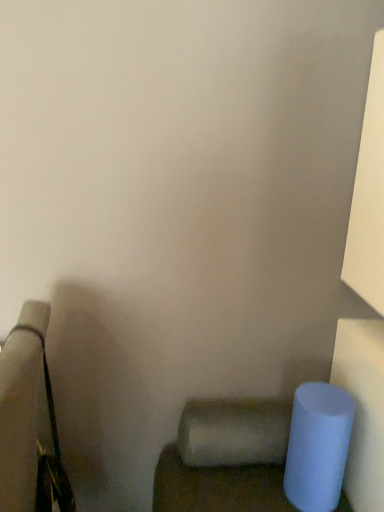
Question: Is satin white toilet paper at lower center taller or shorter than matte blue cylinder at lower right?

Choices:
 (A) tall
 (B) short

Answer: (B)

Question: Is satin white toilet paper at lower center to the left or to the right of matte blue cylinder at lower right in the image?

Choices:
 (A) right
 (B) left

Answer: (B)

Question: Considering the positions of satin white toilet paper at lower center and matte blue cylinder at lower right in the image, is satin white toilet paper at lower center bigger or smaller than matte blue cylinder at lower right?

Choices:
 (A) big
 (B) small

Answer: (B)

Question: Considering the positions of matte blue cylinder at lower right and satin white toilet paper at lower center in the image, is matte blue cylinder at lower right taller or shorter than satin white toilet paper at lower center?

Choices:
 (A) short
 (B) tall

Answer: (B)

Question: Looking at the image, does matte blue cylinder at lower right seem bigger or smaller compared to satin white toilet paper at lower center?

Choices:
 (A) small
 (B) big

Answer: (B)

Question: Is matte blue cylinder at lower right wider or thinner than satin white toilet paper at lower center?

Choices:
 (A) wide
 (B) thin

Answer: (A)

Question: From a real-world perspective, is matte blue cylinder at lower right positioned above or below satin white toilet paper at lower center?

Choices:
 (A) above
 (B) below

Answer: (B)